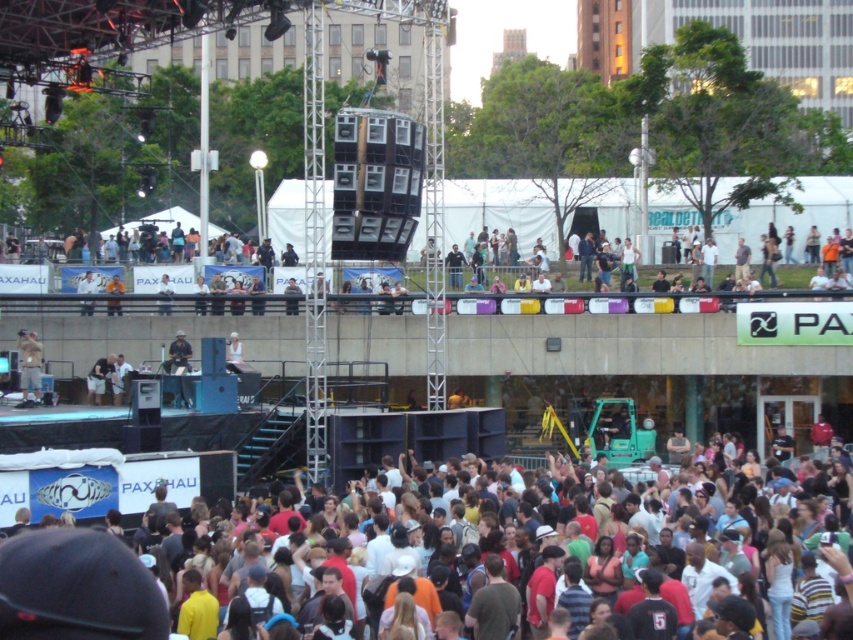
Who is higher up, multicolored casual attire at lower center or light brown leather jacket at center?

light brown leather jacket at center is above.

Is point (13, 497) positioned after point (113, 364)?

No.

At what (x,y) coordinates should I click in order to perform the action: click on multicolored casual attire at lower center. Please return your answer as a coordinate pair (x, y). The image size is (853, 640). Looking at the image, I should click on (54, 467).

What do you see at coordinates (28, 365) in the screenshot? I see `light brown leather jacket at lower left` at bounding box center [28, 365].

Is point (28, 348) closer to camera compared to point (107, 368)?

Yes, point (28, 348) is closer to viewer.

Which is in front, point (41, 352) or point (96, 378)?

Point (41, 352)

Find the location of a particular element. Image resolution: width=853 pixels, height=640 pixels. light brown leather jacket at lower left is located at coordinates (28, 365).

Which is below, multicolored casual attire at lower center or light brown leather jacket at lower left?

multicolored casual attire at lower center

Does multicolored casual attire at lower center appear on the left side of light brown leather jacket at lower left?

In fact, multicolored casual attire at lower center is to the right of light brown leather jacket at lower left.

The width and height of the screenshot is (853, 640). In order to click on multicolored casual attire at lower center in this screenshot , I will do tap(54, 467).

Find the location of a particular element. This screenshot has height=640, width=853. multicolored casual attire at lower center is located at coordinates [x=54, y=467].